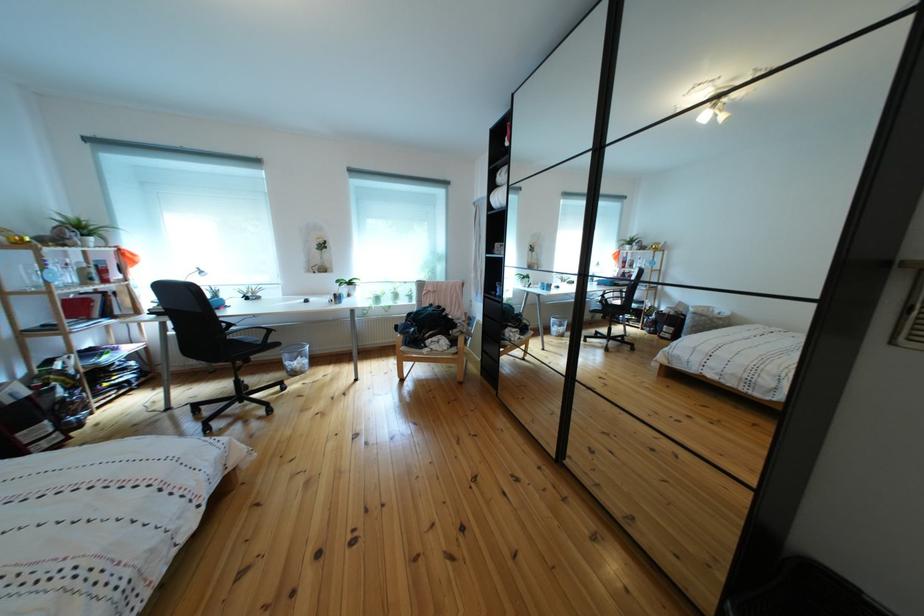
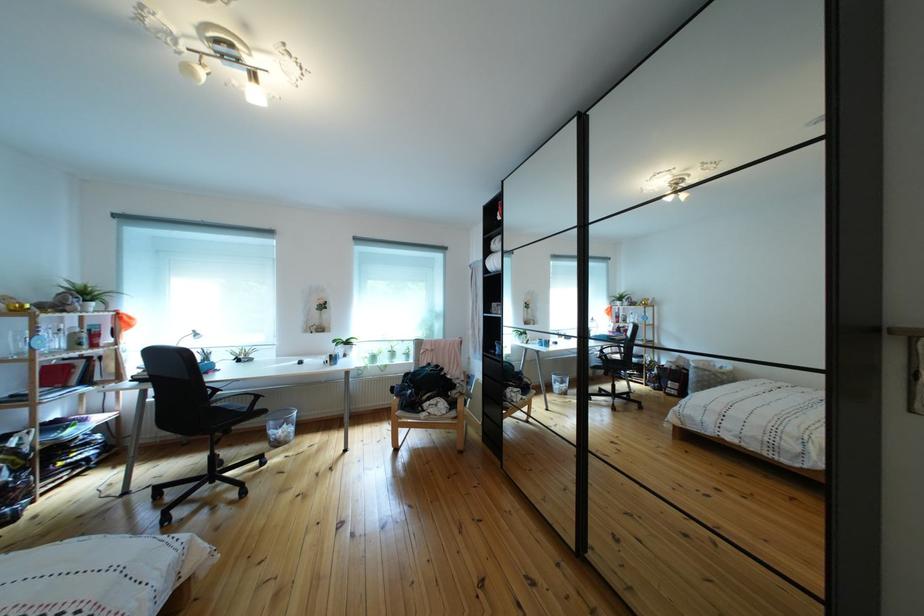
The point at (297, 362) is marked in the first image. Where is the corresponding point in the second image?

(283, 430)